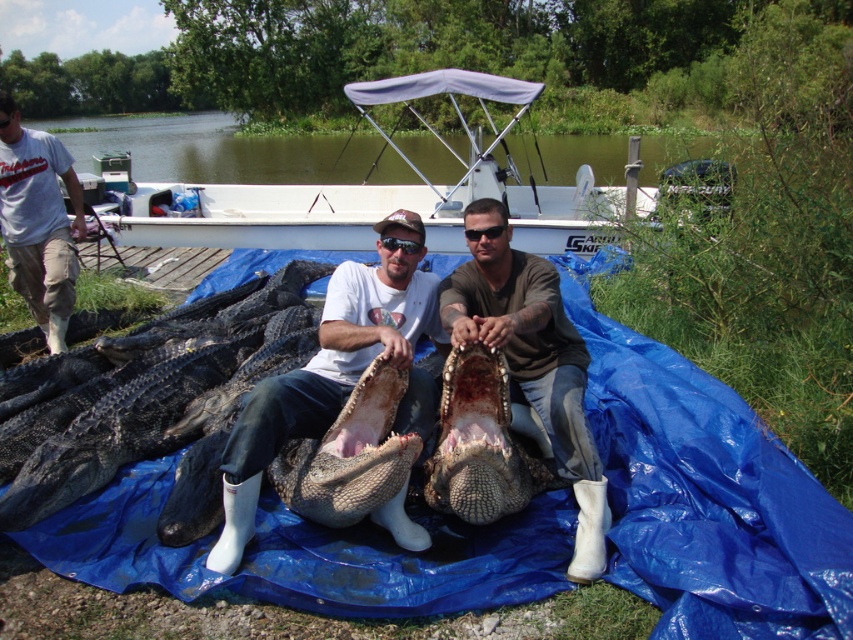
Who is more distant from viewer, (444,346) or (9,164)?

The point (9,164) is behind.

The width and height of the screenshot is (853, 640). What do you see at coordinates (328, 371) in the screenshot? I see `white rubber boots at center` at bounding box center [328, 371].

Where is `white rubber boots at center`? The width and height of the screenshot is (853, 640). white rubber boots at center is located at coordinates (328, 371).

Between white rubber boots at center and brown leather boots at center, which one appears on the left side from the viewer's perspective?

white rubber boots at center

Does point (260, 445) come in front of point (515, 348)?

Yes, point (260, 445) is closer to viewer.

What are the coordinates of `white rubber boots at center` in the screenshot? It's located at (328, 371).

Between point (331, 300) and point (68, 464), which one is positioned in front?

Point (331, 300) is more forward.

Between point (347, 284) and point (137, 433), which one is positioned behind?

Positioned behind is point (137, 433).

Image resolution: width=853 pixels, height=640 pixels. In order to click on white rubber boots at center in this screenshot , I will do `click(328, 371)`.